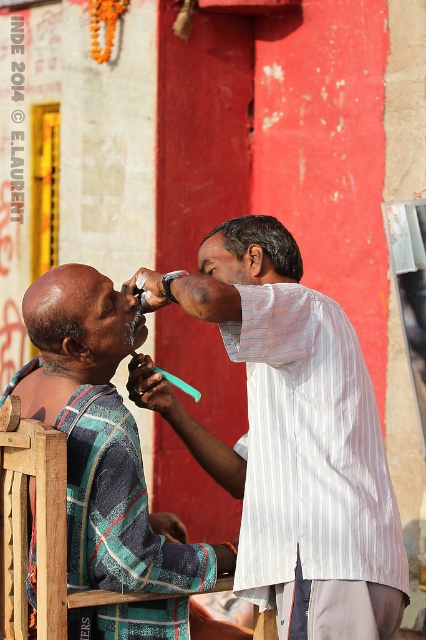
Question: Among these objects, which one is farthest from the camera?

Choices:
 (A) striped fabric shirt at left
 (B) white striped shirt at upper center

Answer: (A)

Question: Among these objects, which one is nearest to the camera?

Choices:
 (A) white striped shirt at upper center
 (B) striped fabric shirt at left

Answer: (A)

Question: Does white striped shirt at upper center appear under striped fabric shirt at left?

Choices:
 (A) yes
 (B) no

Answer: (B)

Question: Is white striped shirt at upper center smaller than striped fabric shirt at left?

Choices:
 (A) no
 (B) yes

Answer: (B)

Question: Is white striped shirt at upper center above striped fabric shirt at left?

Choices:
 (A) yes
 (B) no

Answer: (A)